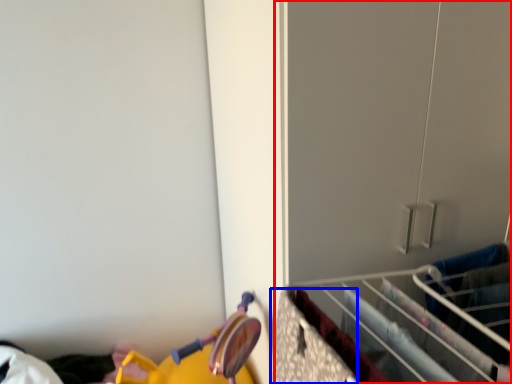
Question: Which object appears farthest to the camera in this image, closet (highlighted by a red box) or drawer (highlighted by a blue box)?

Choices:
 (A) closet
 (B) drawer

Answer: (A)